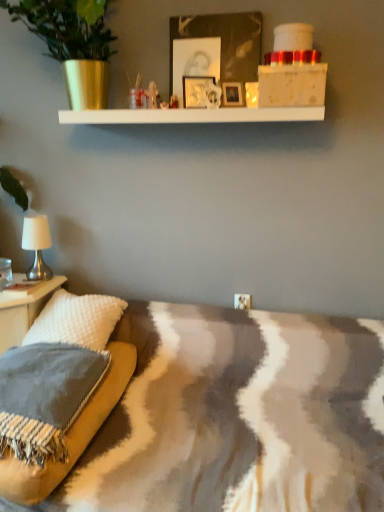
Question: Should I look upward or downward to see textured gray pillow at lower left?

Choices:
 (A) down
 (B) up

Answer: (A)

Question: Does white textured pillow at left have a lesser height compared to metallic silver picture frame at upper center?

Choices:
 (A) yes
 (B) no

Answer: (B)

Question: Can you confirm if white textured pillow at left is taller than metallic silver picture frame at upper center?

Choices:
 (A) yes
 (B) no

Answer: (A)

Question: Is white textured pillow at left facing towards metallic silver picture frame at upper center?

Choices:
 (A) no
 (B) yes

Answer: (A)

Question: Can you confirm if white textured pillow at left is wider than metallic silver picture frame at upper center?

Choices:
 (A) yes
 (B) no

Answer: (A)

Question: Would you consider white textured pillow at left to be distant from metallic silver picture frame at upper center?

Choices:
 (A) yes
 (B) no

Answer: (A)

Question: Is metallic silver picture frame at upper center a part of white textured pillow at left?

Choices:
 (A) yes
 (B) no

Answer: (B)

Question: From a real-world perspective, is white textured pillow at left positioned under white fabric lampshade at left based on gravity?

Choices:
 (A) no
 (B) yes

Answer: (B)

Question: Considering the relative sizes of white textured pillow at left and white fabric lampshade at left in the image provided, is white textured pillow at left taller than white fabric lampshade at left?

Choices:
 (A) no
 (B) yes

Answer: (B)

Question: From the image's perspective, would you say white textured pillow at left is shown under white fabric lampshade at left?

Choices:
 (A) no
 (B) yes

Answer: (B)

Question: Does white textured pillow at left have a lesser height compared to white fabric lampshade at left?

Choices:
 (A) yes
 (B) no

Answer: (B)

Question: Does white textured pillow at left come in front of white fabric lampshade at left?

Choices:
 (A) yes
 (B) no

Answer: (A)

Question: From a real-world perspective, is white textured pillow at left physically above white fabric lampshade at left?

Choices:
 (A) yes
 (B) no

Answer: (B)

Question: Is white textured pillow at left facing away from textured gray pillow at lower left?

Choices:
 (A) no
 (B) yes

Answer: (A)